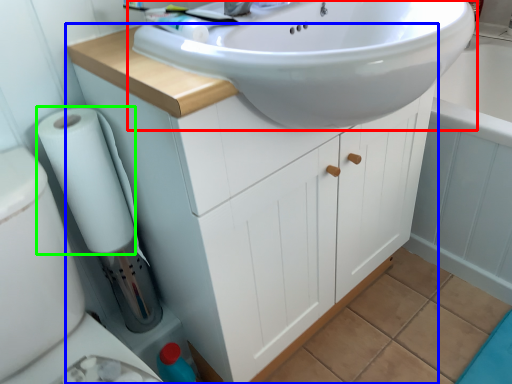
Question: Based on their relative distances, which object is farther from sink (highlighted by a red box)? Choose from bathroom cabinet (highlighted by a blue box) and toilet paper (highlighted by a green box).

Choices:
 (A) bathroom cabinet
 (B) toilet paper

Answer: (B)